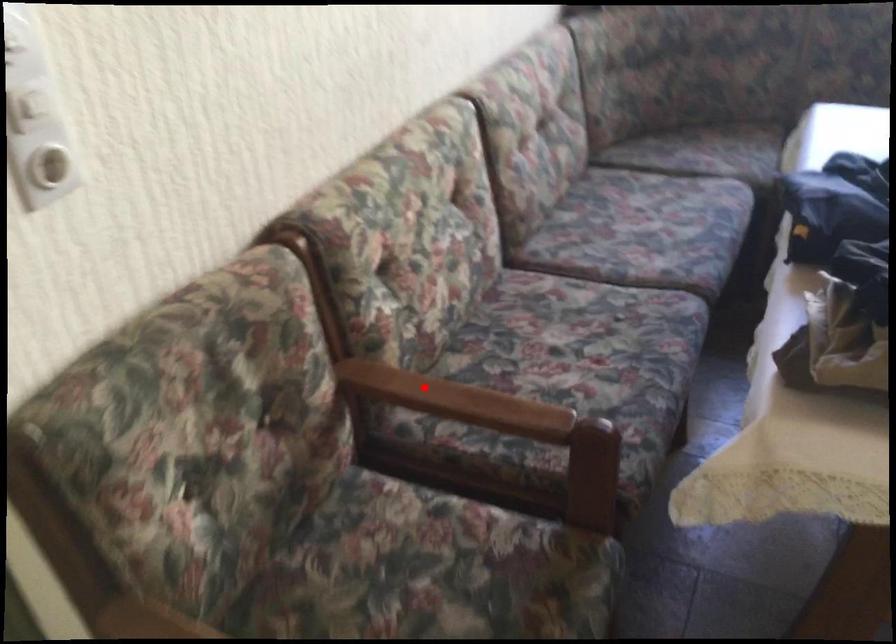
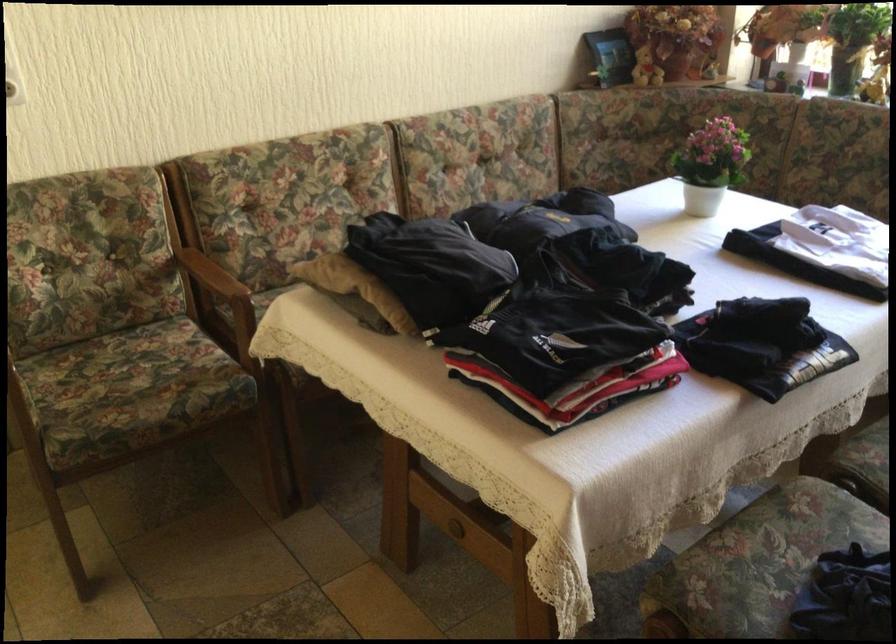
In the second image, find the point that corresponds to the highlighted location in the first image.

(204, 269)